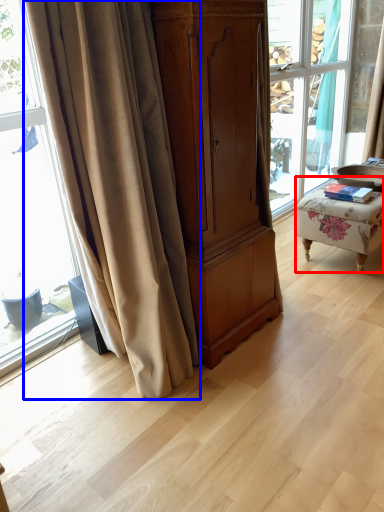
Question: Which object appears closest to the camera in this image, furniture (highlighted by a red box) or curtain (highlighted by a blue box)?

Choices:
 (A) furniture
 (B) curtain

Answer: (B)